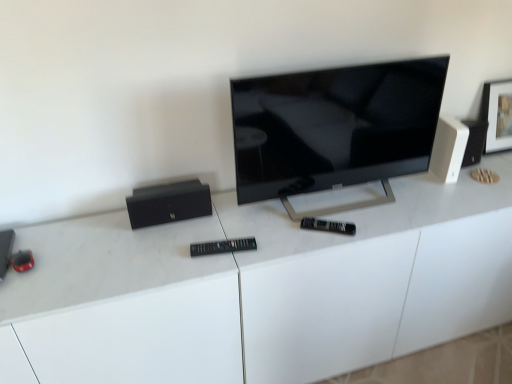
I want to click on free spot to the left of black glossy tv at center, so click(x=219, y=238).